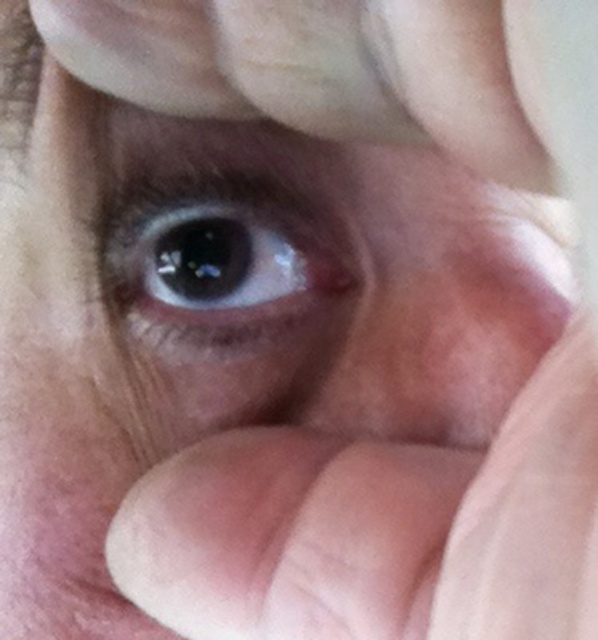
Question: Is dry skin at center wider than brown matte eye at center?

Choices:
 (A) yes
 (B) no

Answer: (A)

Question: From the image, what is the correct spatial relationship of dry skin at center in relation to brown matte eye at center?

Choices:
 (A) below
 (B) above

Answer: (A)

Question: Considering the real-world distances, which object is farthest from the brown matte eye at center?

Choices:
 (A) dry skin at center
 (B) smooth skin at center

Answer: (B)

Question: Which is nearer to the brown matte eye at center?

Choices:
 (A) dry skin at center
 (B) smooth skin at center

Answer: (A)

Question: Is dry skin at center closer to camera compared to brown matte eye at center?

Choices:
 (A) yes
 (B) no

Answer: (A)

Question: Which point is farther to the camera?

Choices:
 (A) (453, 317)
 (B) (289, 243)
 (C) (164, 560)

Answer: (B)